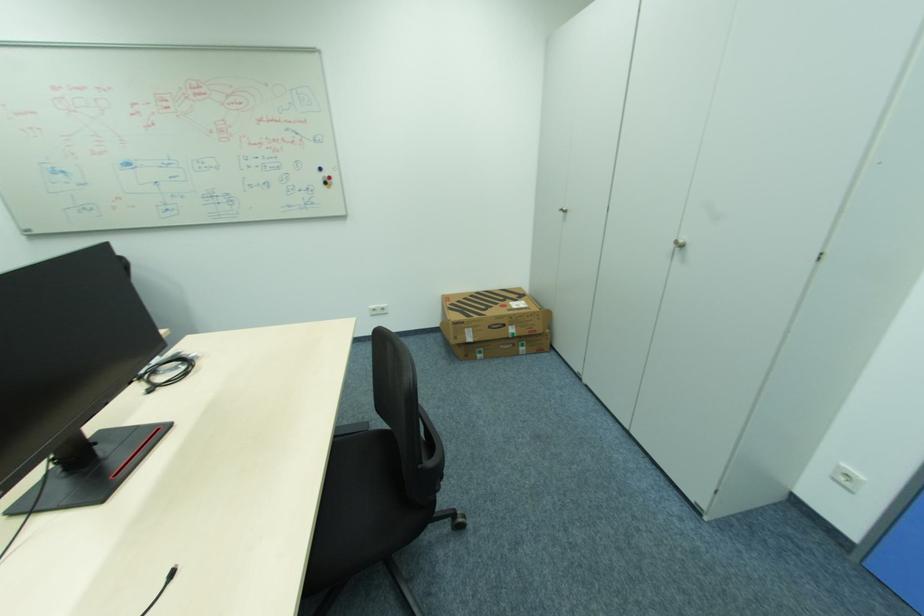
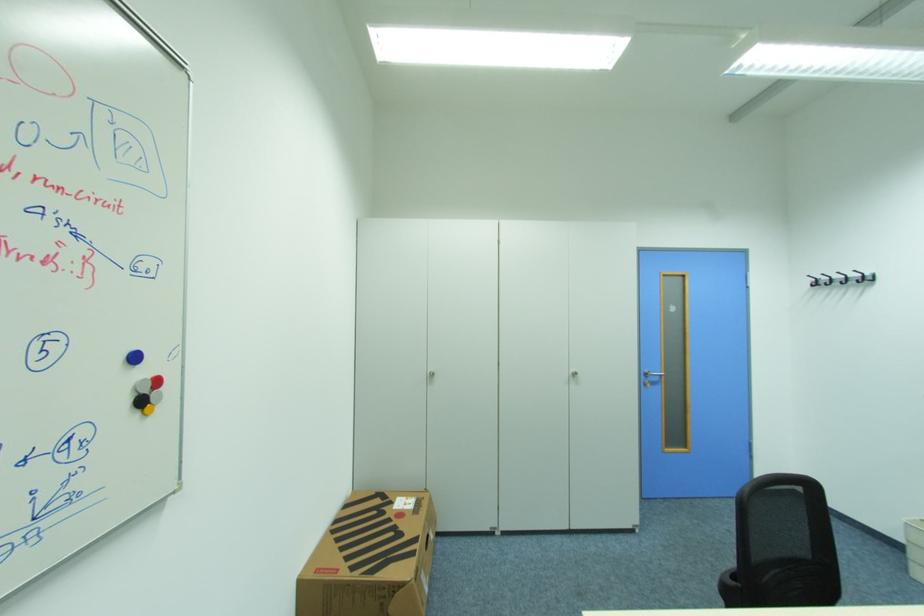
In the second image, find the point that corresponds to point (331, 184) in the first image.

(146, 403)